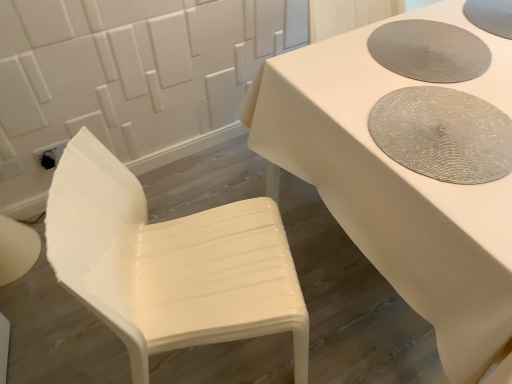
Where is `space that is in front of textured gray placemat at upper right, the second manhole cover positioned from the bottom`? Image resolution: width=512 pixels, height=384 pixels. space that is in front of textured gray placemat at upper right, the second manhole cover positioned from the bottom is located at coordinates (425, 112).